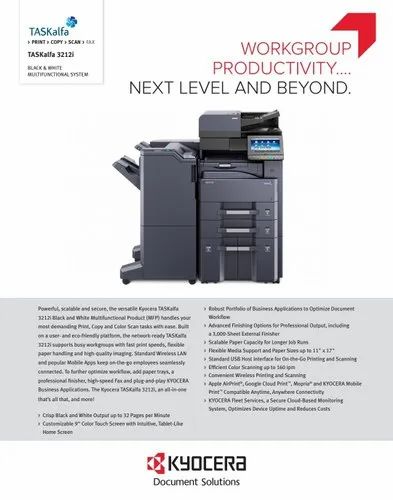
Identify the location of copy machine. (223, 187).